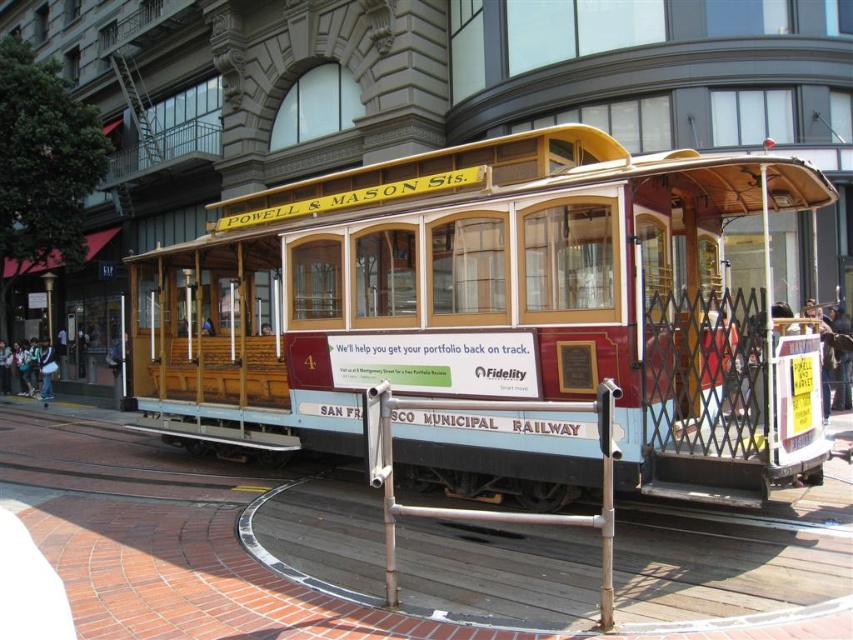
Question: Does wooden cable car at center appear under silver metallic rail at lower center?

Choices:
 (A) yes
 (B) no

Answer: (B)

Question: Where is wooden cable car at center located in relation to silver metallic rail at lower center in the image?

Choices:
 (A) left
 (B) right

Answer: (A)

Question: From the image, what is the correct spatial relationship of wooden cable car at center in relation to silver metallic rail at lower center?

Choices:
 (A) left
 (B) right

Answer: (A)

Question: Which of the following is the closest to the observer?

Choices:
 (A) (440, 397)
 (B) (788, 429)

Answer: (B)